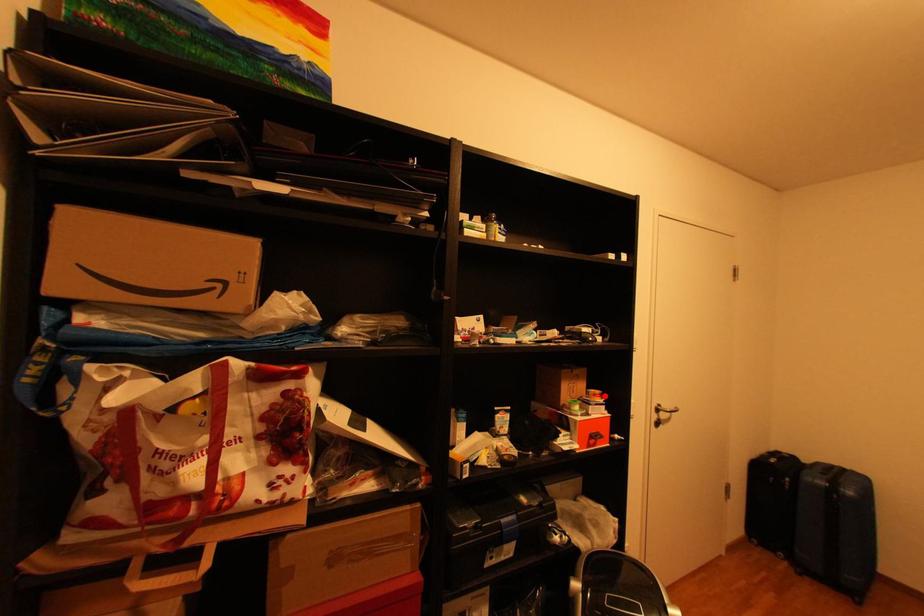
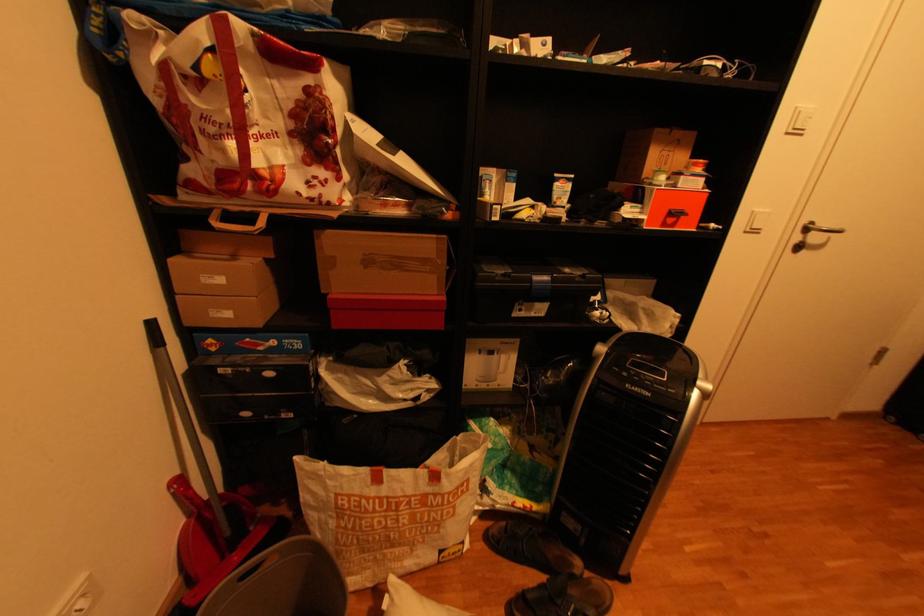
In the second image, find the point that corresponds to the highlighted location in the first image.

(704, 166)